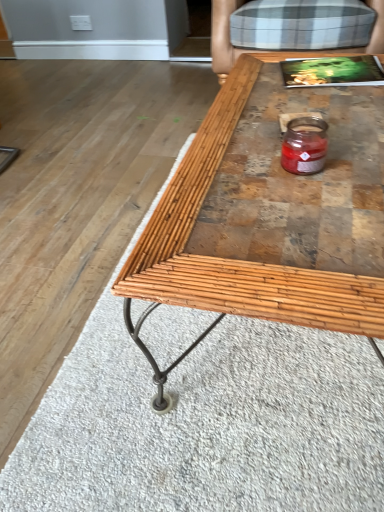
Question: Is translucent glass candle at center taller than plaid fabric armchair at upper right?

Choices:
 (A) yes
 (B) no

Answer: (B)

Question: Is translucent glass candle at center smaller than plaid fabric armchair at upper right?

Choices:
 (A) no
 (B) yes

Answer: (B)

Question: Is plaid fabric armchair at upper right inside translucent glass candle at center?

Choices:
 (A) no
 (B) yes

Answer: (A)

Question: Is translucent glass candle at center oriented towards plaid fabric armchair at upper right?

Choices:
 (A) no
 (B) yes

Answer: (A)

Question: From the image's perspective, is translucent glass candle at center located above plaid fabric armchair at upper right?

Choices:
 (A) no
 (B) yes

Answer: (A)

Question: Looking at the image, does plaid fabric armchair at upper right seem bigger or smaller compared to bamboo wood coffee table at center?

Choices:
 (A) big
 (B) small

Answer: (A)

Question: Is plaid fabric armchair at upper right in front of or behind bamboo wood coffee table at center in the image?

Choices:
 (A) front
 (B) behind

Answer: (B)

Question: Is plaid fabric armchair at upper right spatially inside bamboo wood coffee table at center, or outside of it?

Choices:
 (A) inside
 (B) outside

Answer: (B)

Question: From the image's perspective, is plaid fabric armchair at upper right located above or below bamboo wood coffee table at center?

Choices:
 (A) below
 (B) above

Answer: (B)

Question: In the image, is translucent glass candle at center positioned in front of or behind plaid fabric armchair at upper right?

Choices:
 (A) behind
 (B) front

Answer: (B)

Question: Based on their positions, is translucent glass candle at center located to the left or right of plaid fabric armchair at upper right?

Choices:
 (A) right
 (B) left

Answer: (B)

Question: From the image's perspective, is translucent glass candle at center located above or below plaid fabric armchair at upper right?

Choices:
 (A) below
 (B) above

Answer: (A)

Question: Does point click(x=296, y=126) appear closer or farther from the camera than point click(x=215, y=19)?

Choices:
 (A) farther
 (B) closer

Answer: (B)

Question: In the image, is bamboo wood coffee table at center positioned in front of or behind translucent glass candle at center?

Choices:
 (A) front
 (B) behind

Answer: (A)

Question: From a real-world perspective, is bamboo wood coffee table at center physically located above or below translucent glass candle at center?

Choices:
 (A) above
 (B) below

Answer: (B)